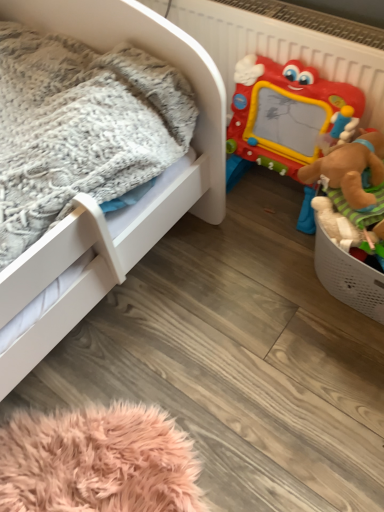
Question: Considering the positions of plastic drawing board at right and white matte infant bed at left in the image, is plastic drawing board at right bigger or smaller than white matte infant bed at left?

Choices:
 (A) small
 (B) big

Answer: (A)

Question: From a real-world perspective, relative to white matte infant bed at left, is plastic drawing board at right vertically above or below?

Choices:
 (A) above
 (B) below

Answer: (B)

Question: Relative to white matte infant bed at left, is plastic drawing board at right in front or behind?

Choices:
 (A) front
 (B) behind

Answer: (B)

Question: From their relative heights in the image, would you say white matte infant bed at left is taller or shorter than plastic drawing board at right?

Choices:
 (A) tall
 (B) short

Answer: (A)

Question: Is white matte infant bed at left in front of or behind plastic drawing board at right in the image?

Choices:
 (A) front
 (B) behind

Answer: (A)

Question: In the image, is white matte infant bed at left on the left side or the right side of plastic drawing board at right?

Choices:
 (A) right
 (B) left

Answer: (B)

Question: From the image's perspective, is white matte infant bed at left above or below plastic drawing board at right?

Choices:
 (A) below
 (B) above

Answer: (A)